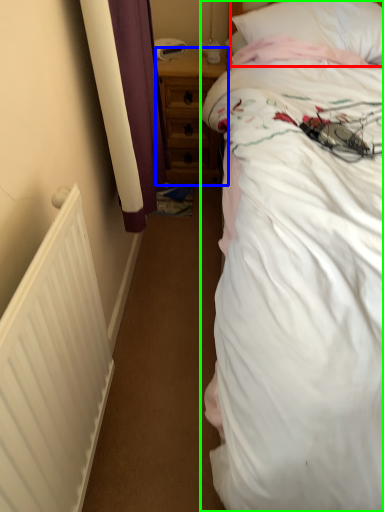
Question: Based on their relative distances, which object is farther from pillow (highlighted by a red box)? Choose from nightstand (highlighted by a blue box) and bed (highlighted by a green box).

Choices:
 (A) nightstand
 (B) bed

Answer: (A)